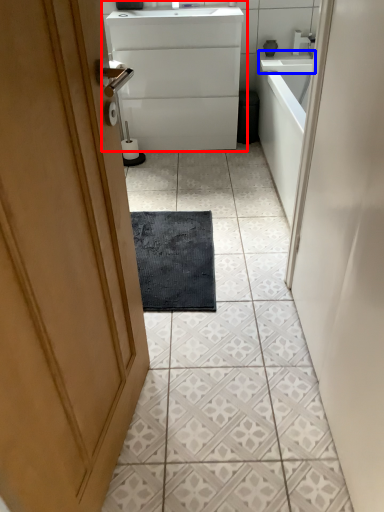
Question: Which object is further to the camera taking this photo, bathroom cabinet (highlighted by a red box) or counter top (highlighted by a blue box)?

Choices:
 (A) bathroom cabinet
 (B) counter top

Answer: (B)